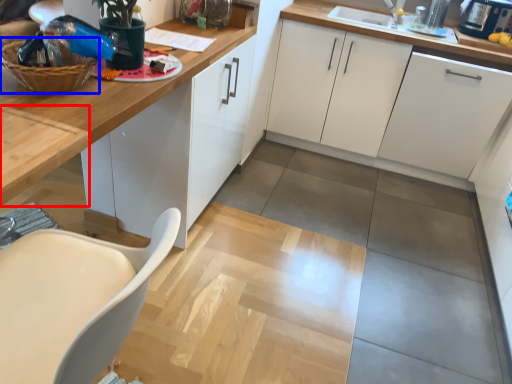
Question: Which point is closer to the camera, table (highlighted by a red box) or basket (highlighted by a blue box)?

Choices:
 (A) table
 (B) basket

Answer: (A)